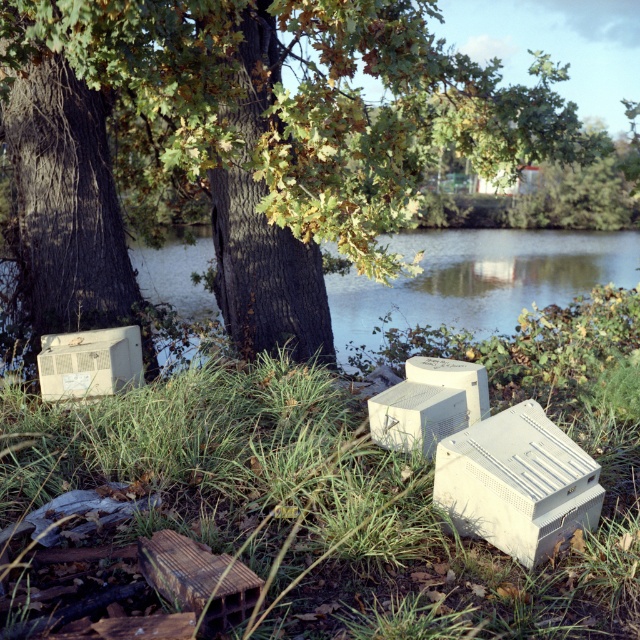
Measure the distance between point (292, 365) and camera.

They are 7.80 meters apart.

Is green grass at center taller than transparent water at center?

Incorrect, green grass at center's height is not larger of transparent water at center's.

This screenshot has width=640, height=640. Identify the location of green grass at center. (356, 483).

Who is more distant from viewer, (248, 326) or (451, 547)?

Positioned behind is point (248, 326).

Which is below, matte brown tree trunk at center or green grass at center?

green grass at center is below.

Locate an element on the screen. matte brown tree trunk at center is located at coordinates (248, 144).

Does matte brown tree trunk at center lie behind transparent water at center?

That is False.

Is point (68, 115) closer to viewer compared to point (344, 304)?

Yes, it is in front of point (344, 304).

Who is more distant from viewer, (400, 32) or (428, 316)?

Point (428, 316)

You are a GUI agent. You are given a task and a screenshot of the screen. Output one action in this format:
    pyautogui.click(x=<x>, y=<y>)
    Task: Click on the matte brown tree trunk at center
    The width and height of the screenshot is (640, 640).
    Given the screenshot: What is the action you would take?
    [x=248, y=144]